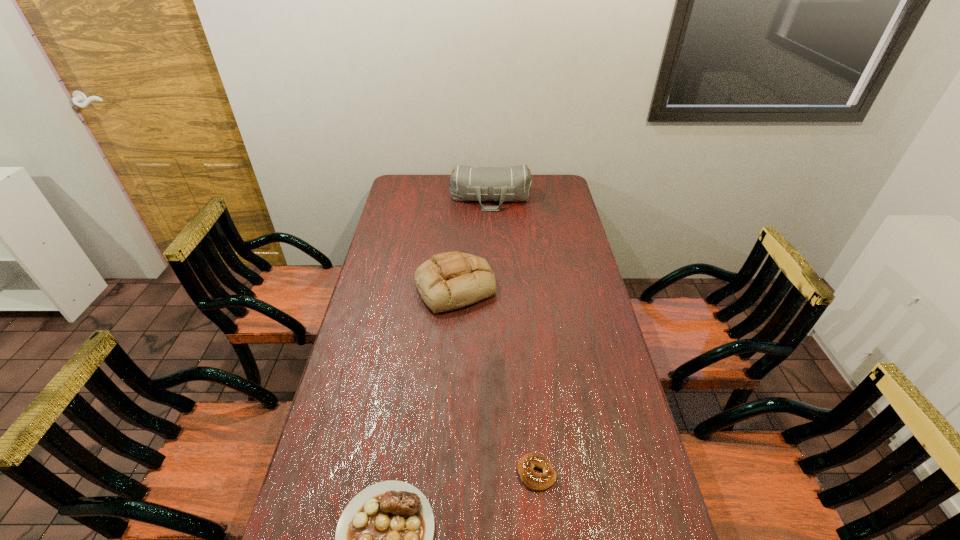
The image size is (960, 540). In order to click on duffel bag in this screenshot , I will do [x=467, y=183].

What are the coordinates of `the tallest object` in the screenshot? It's located at (467, 183).

The height and width of the screenshot is (540, 960). I want to click on bread, so click(450, 280).

You are a GUI agent. You are given a task and a screenshot of the screen. Output one action in this format:
    pyautogui.click(x=<x>, y=<y>)
    Task: Click on the second tallest object
    The height and width of the screenshot is (540, 960).
    Given the screenshot: What is the action you would take?
    pyautogui.click(x=450, y=280)

The image size is (960, 540). Identify the location of the shortest object. click(x=539, y=481).

The height and width of the screenshot is (540, 960). Find the location of `vacant region located on the left of the duffel bag`. vacant region located on the left of the duffel bag is located at coordinates (433, 199).

Identify the location of vacant area located on the front of the third shortest object. (447, 414).

Where is `free location located on the back of the bagel`? This screenshot has height=540, width=960. free location located on the back of the bagel is located at coordinates (527, 378).

The image size is (960, 540). Find the location of `object located in the far edge section of the desktop`. object located in the far edge section of the desktop is located at coordinates tap(467, 183).

Locate an element on the screen. The width and height of the screenshot is (960, 540). free space at the far edge of the desktop is located at coordinates click(425, 191).